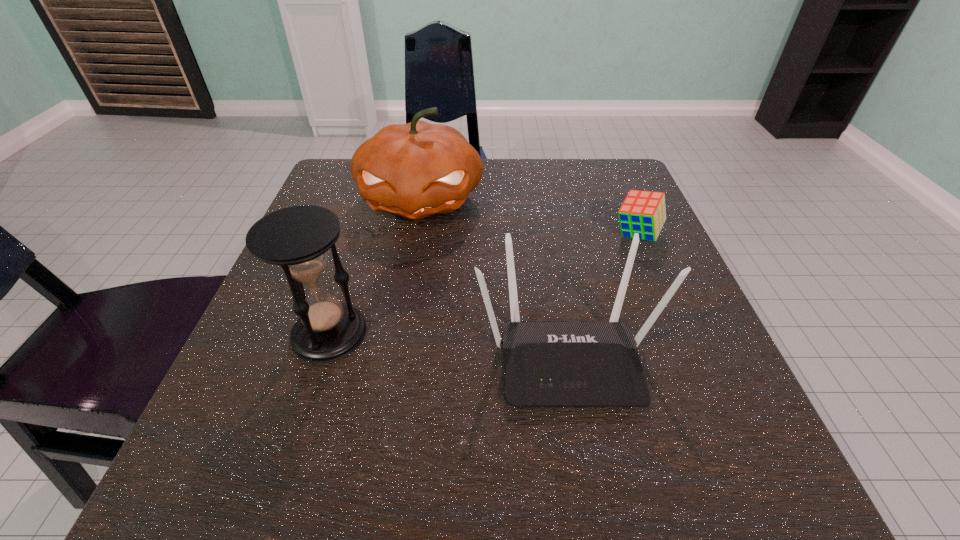
This screenshot has height=540, width=960. I want to click on pumpkin, so click(415, 170).

Identify the location of hourglass. The height and width of the screenshot is (540, 960). (297, 238).

Locate an element on the screen. The width and height of the screenshot is (960, 540). router is located at coordinates (546, 364).

Locate an element on the screen. the shortest object is located at coordinates (643, 212).

The width and height of the screenshot is (960, 540). I want to click on free location located 0.340m on the front face of the pumpkin, so pos(388,384).

Locate an element on the screen. free region located on the right of the hourglass is located at coordinates (540, 333).

Find the location of a particular element. vacant space situated 0.080m on the front-facing side of the router is located at coordinates (588, 471).

This screenshot has width=960, height=540. Find the location of `vacant space located 0.210m on the front of the shortest object`. vacant space located 0.210m on the front of the shortest object is located at coordinates (679, 332).

Locate an element on the screen. This screenshot has height=540, width=960. object that is at the far edge is located at coordinates (415, 170).

Image resolution: width=960 pixels, height=540 pixels. Identify the location of pumpkin that is positioned at the left edge. (415, 170).